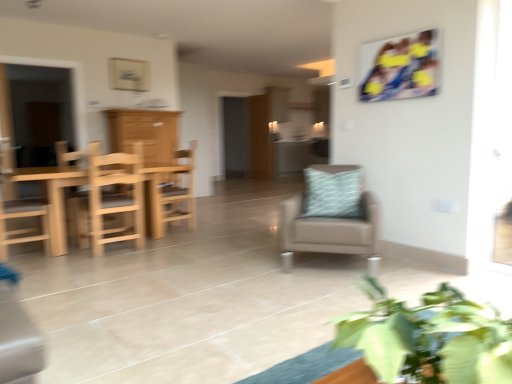
In order to click on wooden door at center in this screenshot , I will do `click(260, 138)`.

This screenshot has width=512, height=384. What do you see at coordinates (37, 112) in the screenshot?
I see `wooden table at left` at bounding box center [37, 112].

This screenshot has height=384, width=512. What are the coordinates of `wooden cabinet at left` in the screenshot? It's located at (145, 133).

Describe the element at coordinates (331, 216) in the screenshot. I see `suede beige chair at center, arranged as the 1th chair when viewed from the right` at that location.

At what (x,y) coordinates should I click in order to perform the action: click on wooden door at center. Please return your answer as a coordinate pair (x, y). The height and width of the screenshot is (384, 512). Looking at the image, I should click on (260, 138).

Is light brown wooden chair at left, arranged as the 1th chair when viewed from the left, located within light blue textured pillow at center?

No, light brown wooden chair at left, arranged as the 1th chair when viewed from the left, is not a part of light blue textured pillow at center.

What's the angular difference between light blue textured pillow at center and light brown wooden chair at left, the 4th chair positioned from the right,'s facing directions?

They differ by 136 degrees in their facing directions.

Which of these two, light blue textured pillow at center or light brown wooden chair at left, the 4th chair positioned from the right, stands shorter?

light blue textured pillow at center is shorter.

Which point is more forward, (341, 168) or (47, 216)?

The point (341, 168) is closer.

Image resolution: width=512 pixels, height=384 pixels. I want to click on the 3rd chair in front when counting from the wooden cabinet at left, so (19, 212).

In terms of width, does wooden cabinet at left look wider or thinner when compared to light brown wooden chair at left, arranged as the 1th chair when viewed from the left?

wooden cabinet at left is wider than light brown wooden chair at left, arranged as the 1th chair when viewed from the left.

Is wooden cabinet at left positioned far away from light brown wooden chair at left, the 4th chair positioned from the right?

Absolutely, wooden cabinet at left is distant from light brown wooden chair at left, the 4th chair positioned from the right.

From a real-world perspective, who is located lower, natural wood chair at left, acting as the 2th chair starting from the left, or green leafy plant at lower right?

natural wood chair at left, acting as the 2th chair starting from the left.

Is natural wood chair at left, positioned as the 3th chair in right-to-left order, positioned beyond the bounds of green leafy plant at lower right?

Yes, natural wood chair at left, positioned as the 3th chair in right-to-left order, is outside of green leafy plant at lower right.

Which of these two, natural wood chair at left, positioned as the 3th chair in right-to-left order, or green leafy plant at lower right, stands shorter?

green leafy plant at lower right.

Does natural wood chair at left, positioned as the 3th chair in right-to-left order, have a larger size compared to green leafy plant at lower right?

Correct, natural wood chair at left, positioned as the 3th chair in right-to-left order, is larger in size than green leafy plant at lower right.

Is green leafy plant at lower right outside of light brown wooden chair at left, arranged as the 1th chair when viewed from the left?

green leafy plant at lower right lies outside light brown wooden chair at left, arranged as the 1th chair when viewed from the left,'s area.

Is green leafy plant at lower right at the right side of light brown wooden chair at left, arranged as the 1th chair when viewed from the left?

Correct, you'll find green leafy plant at lower right to the right of light brown wooden chair at left, arranged as the 1th chair when viewed from the left.

From a real-world perspective, is green leafy plant at lower right beneath light brown wooden chair at left, arranged as the 1th chair when viewed from the left?

No.

Who is taller, green leafy plant at lower right or light brown wooden chair at left, the 4th chair positioned from the right?

light brown wooden chair at left, the 4th chair positioned from the right, is taller.

Which object is further away from the camera, light brown wooden table at left or green leafy plant at lower right?

light brown wooden table at left is more distant.

Would you say light brown wooden table at left is a long distance from green leafy plant at lower right?

Yes, light brown wooden table at left and green leafy plant at lower right are located far from each other.

From the image's perspective, is light brown wooden table at left located above or below green leafy plant at lower right?

light brown wooden table at left is situated higher than green leafy plant at lower right in the image.

Would you say light brown wooden table at left is inside or outside green leafy plant at lower right?

light brown wooden table at left is located beyond the bounds of green leafy plant at lower right.

Is natural wood chair at left, acting as the 2th chair starting from the left, touching wooden table at left?

natural wood chair at left, acting as the 2th chair starting from the left, and wooden table at left are clearly separated.

Considering the sizes of objects natural wood chair at left, positioned as the 3th chair in right-to-left order, and wooden table at left in the image provided, who is taller, natural wood chair at left, positioned as the 3th chair in right-to-left order, or wooden table at left?

With more height is wooden table at left.

There is a wooden table at left. In order to click on the 2nd chair below it (from the image's perspective) in this screenshot , I will do `click(108, 199)`.

Considering the positions of objects natural wood chair at left, acting as the 2th chair starting from the left, and wooden table at left in the image provided, who is more to the left, natural wood chair at left, acting as the 2th chair starting from the left, or wooden table at left?

Positioned to the left is wooden table at left.

From a real-world perspective, between light brown wooden table at left and light brown wooden chair at left, the 4th chair positioned from the right, who is vertically higher?

From a 3D spatial view, light brown wooden chair at left, the 4th chair positioned from the right, is above.

Can you see light brown wooden table at left touching light brown wooden chair at left, the 4th chair positioned from the right?

light brown wooden table at left and light brown wooden chair at left, the 4th chair positioned from the right, are clearly separated.

In terms of height, does light brown wooden table at left look taller or shorter compared to light brown wooden chair at left, the 4th chair positioned from the right?

Considering their sizes, light brown wooden table at left has less height than light brown wooden chair at left, the 4th chair positioned from the right.

Considering their positions, is light brown wooden table at left located in front of or behind light brown wooden chair at left, the 4th chair positioned from the right?

light brown wooden table at left is in front of light brown wooden chair at left, the 4th chair positioned from the right.

This screenshot has width=512, height=384. Identify the location of pillow on the right of light brown wooden chair at left, the 4th chair positioned from the right. (333, 192).

In order to click on the 2nd chair counting from the left side of the wooden cabinet at left in this screenshot , I will do `click(19, 212)`.

Based on their spatial positions, is suede beige chair at center, arranged as the 1th chair when viewed from the right, or green leafy plant at lower right closer to natural wood chair at left, acting as the 2th chair starting from the left?

suede beige chair at center, arranged as the 1th chair when viewed from the right.

Which object lies further to the anchor point wooden door at center, wooden chair at center, which is the 2th chair from right to left, or wooden cabinet at left?

wooden chair at center, which is the 2th chair from right to left, is positioned further to the anchor wooden door at center.

Considering their positions, is suede beige chair at center, arranged as the 1th chair when viewed from the right, positioned closer to green leafy plant at lower right than light brown wooden table at left?

suede beige chair at center, arranged as the 1th chair when viewed from the right.

Which object lies further to the anchor point wooden cabinet at left, natural wood chair at left, positioned as the 3th chair in right-to-left order, or light brown wooden chair at left, the 4th chair positioned from the right?

light brown wooden chair at left, the 4th chair positioned from the right.

Estimate the real-world distances between objects in this image. Which object is closer to wooden table at left, wooden cabinet at left or light brown wooden table at left?

Among the two, wooden cabinet at left is located nearer to wooden table at left.

From the image, which object appears to be farther from light brown wooden chair at left, arranged as the 1th chair when viewed from the left, wooden chair at center, which is counted as the 3th chair, starting from the left, or wooden cabinet at left?

wooden cabinet at left.

Consider the image. When comparing their distances from wooden chair at center, which is the 2th chair from right to left, does light blue textured pillow at center or wooden cabinet at left seem closer?

wooden cabinet at left is closer to wooden chair at center, which is the 2th chair from right to left.

When comparing their distances from suede beige chair at center, arranged as the 1th chair when viewed from the right, does wooden chair at center, which is counted as the 3th chair, starting from the left, or light brown wooden chair at left, the 4th chair positioned from the right, seem further?

Among the two, light brown wooden chair at left, the 4th chair positioned from the right, is located further to suede beige chair at center, arranged as the 1th chair when viewed from the right.

Identify the location of table positioned between green leafy plant at lower right and natural wood chair at left, acting as the 2th chair starting from the left, from near to far. (54, 198).

Identify the location of table between green leafy plant at lower right and wooden cabinet at left along the z-axis. (54, 198).

Find the location of `pillow between green leafy plant at lower right and wooden door at center along the z-axis`. pillow between green leafy plant at lower right and wooden door at center along the z-axis is located at coordinates (333, 192).

Image resolution: width=512 pixels, height=384 pixels. What are the coordinates of `cabinetry located between wooden chair at center, which is the 2th chair from right to left, and wooden door at center in the depth direction` in the screenshot? It's located at (145, 133).